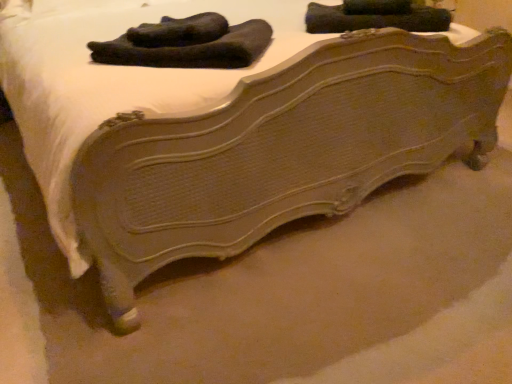
Question: From the image's perspective, does velvet-like black socks at upper center appear lower than black fuzzy socks at upper center?

Choices:
 (A) no
 (B) yes

Answer: (A)

Question: Are velvet-like black socks at upper center and black fuzzy socks at upper center beside each other?

Choices:
 (A) no
 (B) yes

Answer: (A)

Question: Considering the relative sizes of velvet-like black socks at upper center and black fuzzy socks at upper center in the image provided, is velvet-like black socks at upper center bigger than black fuzzy socks at upper center?

Choices:
 (A) yes
 (B) no

Answer: (A)

Question: Considering the relative positions of velvet-like black socks at upper center and black fuzzy socks at upper center in the image provided, is velvet-like black socks at upper center behind black fuzzy socks at upper center?

Choices:
 (A) yes
 (B) no

Answer: (A)

Question: Would you say velvet-like black socks at upper center is a long distance from black fuzzy socks at upper center?

Choices:
 (A) yes
 (B) no

Answer: (B)

Question: Is velvet-like black socks at upper center to the left of black fuzzy socks at upper center from the viewer's perspective?

Choices:
 (A) no
 (B) yes

Answer: (A)

Question: Is black fuzzy socks at upper center wider than velvet-like black socks at upper center?

Choices:
 (A) yes
 (B) no

Answer: (A)

Question: Could velvet-like black socks at upper center be considered to be inside black fuzzy socks at upper center?

Choices:
 (A) no
 (B) yes

Answer: (A)

Question: Considering the relative sizes of black fuzzy socks at upper center and velvet-like black socks at upper center in the image provided, is black fuzzy socks at upper center bigger than velvet-like black socks at upper center?

Choices:
 (A) no
 (B) yes

Answer: (A)

Question: Is black fuzzy socks at upper center aimed at velvet-like black socks at upper center?

Choices:
 (A) no
 (B) yes

Answer: (A)

Question: Considering the relative sizes of black fuzzy socks at upper center and velvet-like black socks at upper center in the image provided, is black fuzzy socks at upper center smaller than velvet-like black socks at upper center?

Choices:
 (A) yes
 (B) no

Answer: (A)

Question: From the image's perspective, is black fuzzy socks at upper center above velvet-like black socks at upper center?

Choices:
 (A) yes
 (B) no

Answer: (B)

Question: In the image, is black fuzzy socks at upper center on the left side or the right side of velvet-like black socks at upper center?

Choices:
 (A) left
 (B) right

Answer: (A)